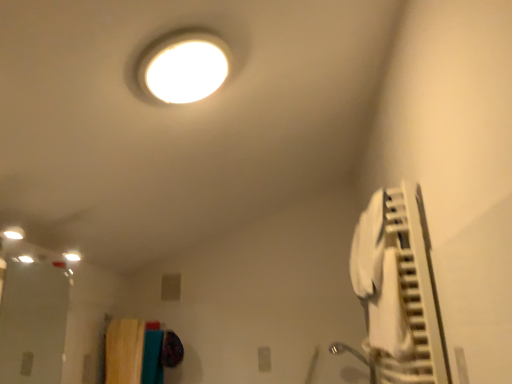
Question: Considering the positions of textured fabric laundry at lower left and transparent glass door at lower left in the image, is textured fabric laundry at lower left bigger or smaller than transparent glass door at lower left?

Choices:
 (A) small
 (B) big

Answer: (A)

Question: Is point (117, 380) positioned closer to the camera than point (51, 299)?

Choices:
 (A) closer
 (B) farther

Answer: (A)

Question: Considering the real-world distances, which object is farthest from the transparent glass door at lower left?

Choices:
 (A) textured fabric laundry at lower left
 (B) white fabric air conditioner at right

Answer: (B)

Question: Which is nearer to the white fabric air conditioner at right?

Choices:
 (A) transparent glass door at lower left
 (B) textured fabric laundry at lower left

Answer: (B)